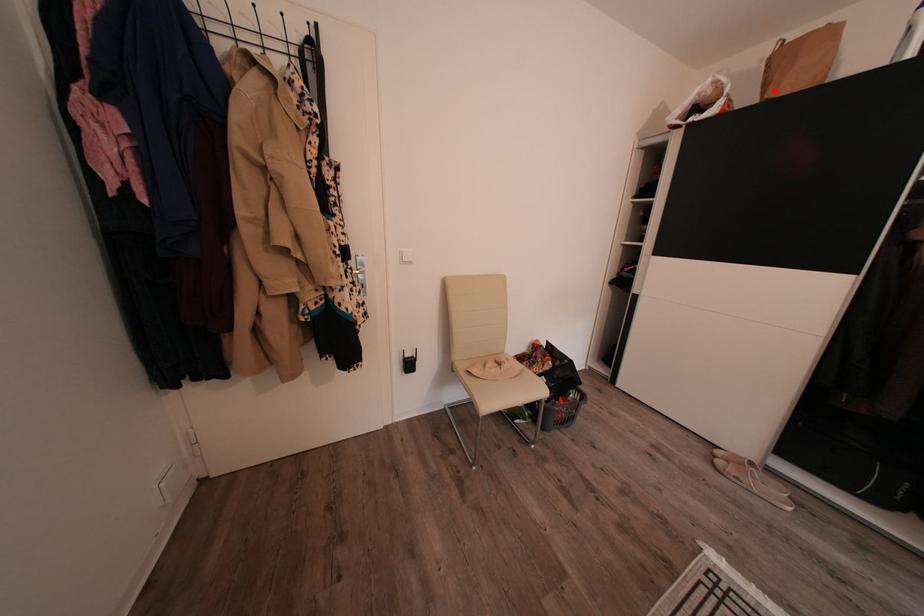
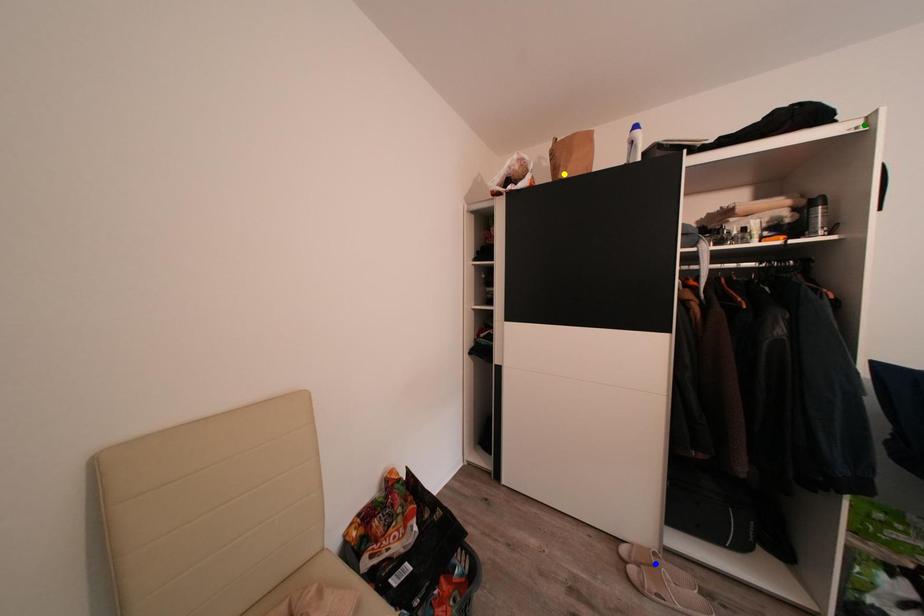
Question: I am providing you with two images of the same scene from different viewpoints. A red point is marked on the first image. You are given multiple points on the second image. Which spot in image 2 lines up with the point in image 1?

Choices:
 (A) green point
 (B) blue point
 (C) yellow point

Answer: (C)